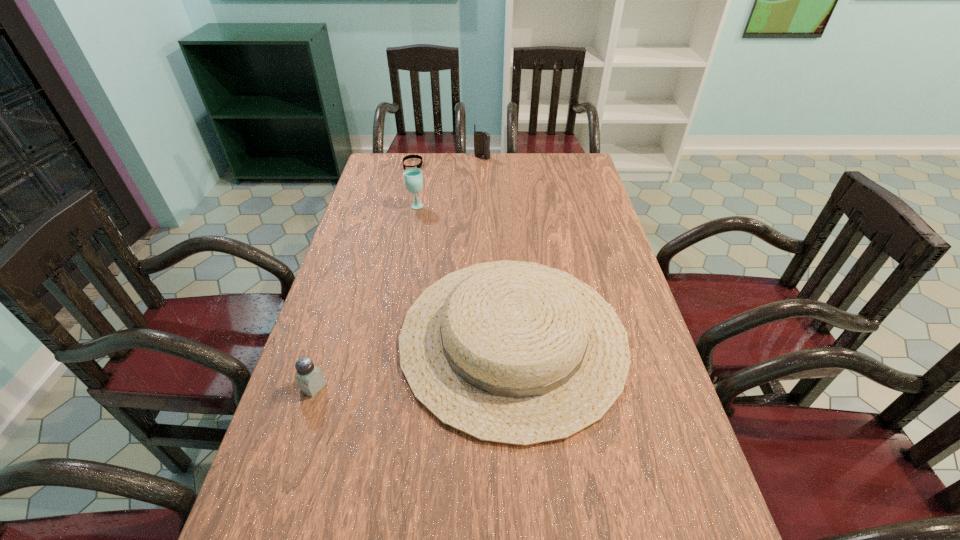
I want to click on vacant space located on the display of the shortest object, so click(x=402, y=211).

I want to click on cellular telephone located at the far edge, so click(x=481, y=139).

The width and height of the screenshot is (960, 540). Find the location of `wristband that is at the far edge`. wristband that is at the far edge is located at coordinates (419, 165).

Find the location of a particular element. The image size is (960, 540). saltshaker that is at the left edge is located at coordinates (310, 379).

Where is `wristband situated at the left edge`? wristband situated at the left edge is located at coordinates (419, 165).

This screenshot has width=960, height=540. Identify the location of object that is positioned at the right edge. (511, 352).

This screenshot has height=540, width=960. In order to click on object present at the far left corner in this screenshot , I will do `click(419, 165)`.

Where is `vacant space at the far edge of the desktop`? The width and height of the screenshot is (960, 540). vacant space at the far edge of the desktop is located at coordinates (435, 175).

Where is `vacant space at the left edge`? The image size is (960, 540). vacant space at the left edge is located at coordinates (325, 310).

What are the coordinates of `free location at the right edge` in the screenshot? It's located at (564, 235).